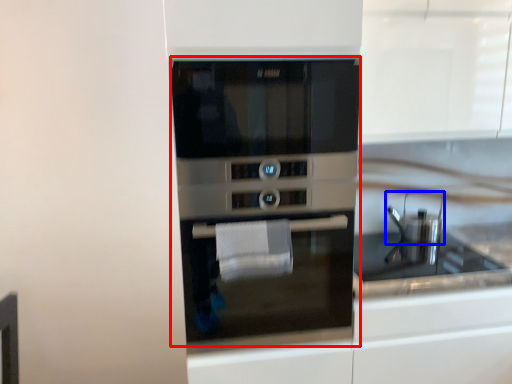
Question: Among these objects, which one is nearest to the camera, oven (highlighted by a red box) or appliance (highlighted by a blue box)?

Choices:
 (A) oven
 (B) appliance

Answer: (A)